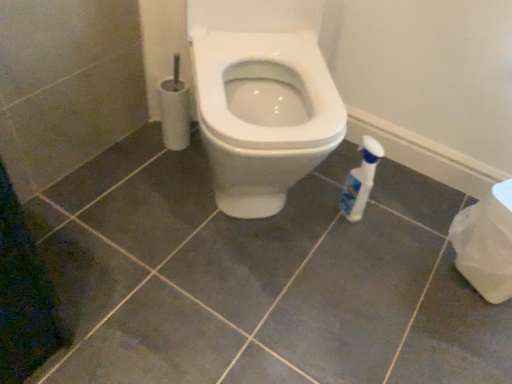
What do you see at coordinates (361, 180) in the screenshot? I see `white plastic spray bottle at lower right` at bounding box center [361, 180].

What are the coordinates of `white plastic spray bottle at lower right` in the screenshot? It's located at (361, 180).

You are a GUI agent. You are given a task and a screenshot of the screen. Output one action in this format:
    pyautogui.click(x=<x>, y=<y>)
    Task: Click on the white plastic spray bottle at lower right
    This screenshot has height=384, width=512.
    Given the screenshot: What is the action you would take?
    pyautogui.click(x=361, y=180)